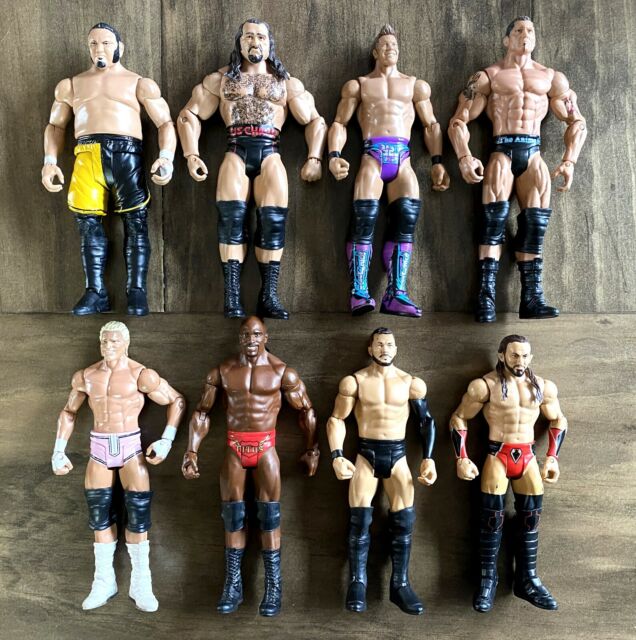
Where is `plastic toys`? plastic toys is located at coordinates (119, 404), (254, 406), (380, 422), (507, 433), (520, 79), (391, 89), (257, 96), (102, 93).